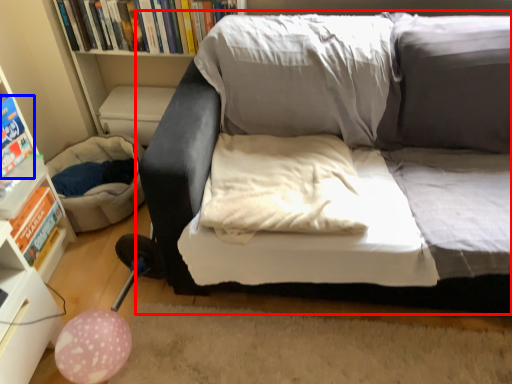
Question: Among these objects, which one is farthest to the camera, studio couch (highlighted by a red box) or paperback book (highlighted by a blue box)?

Choices:
 (A) studio couch
 (B) paperback book

Answer: (B)